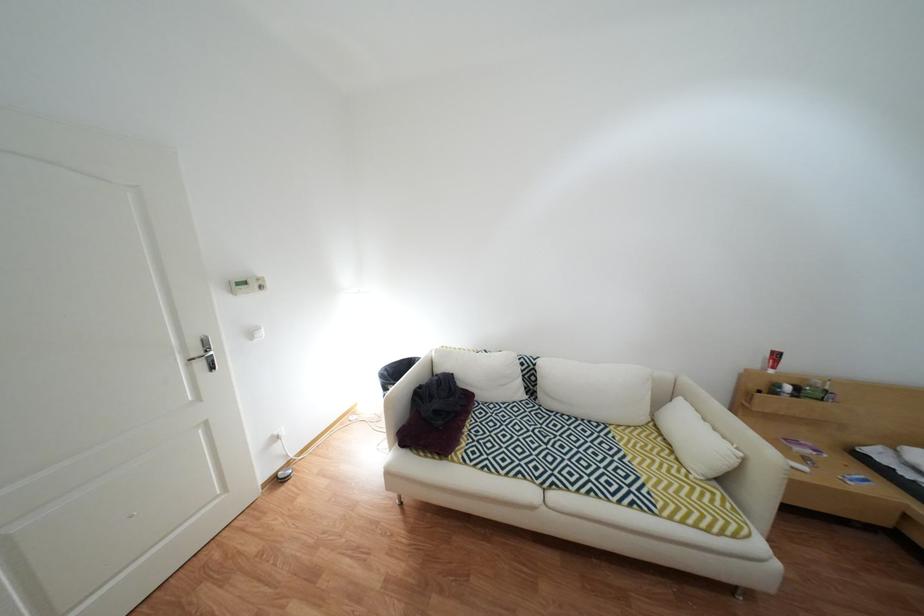
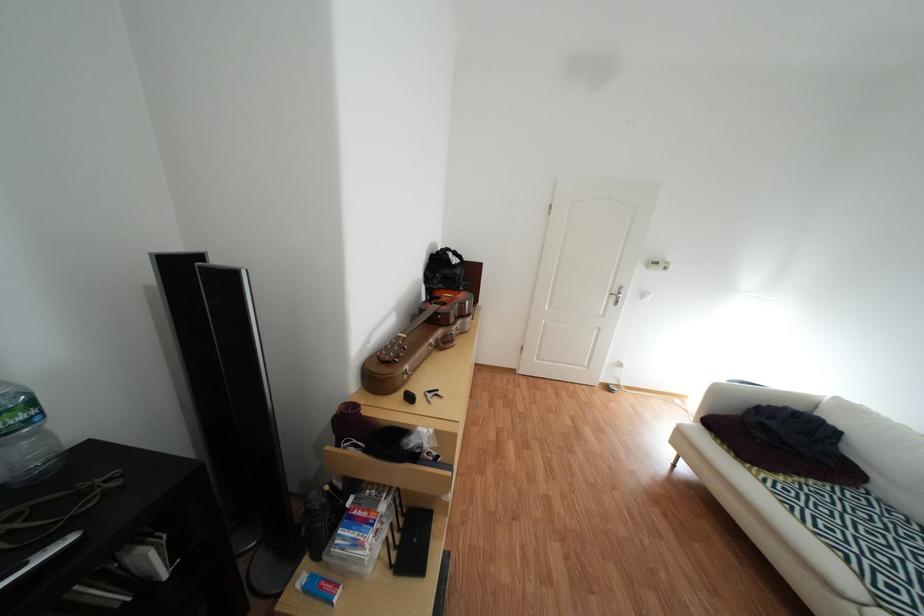
Based on the continuous images, in which direction is the camera rotating?

The rotation direction of the camera is left-down.